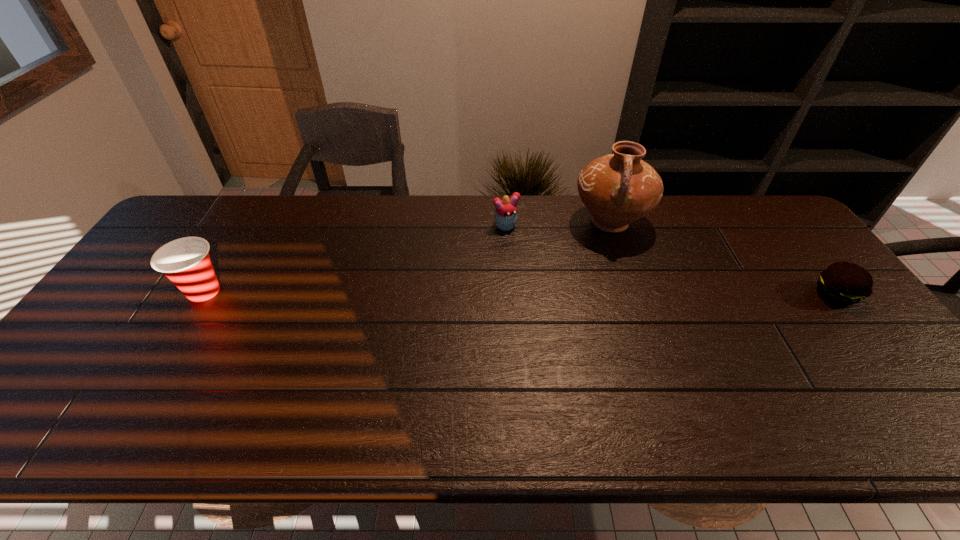
At what (x,y) coordinates should I click in order to perform the action: click on vacant space situated on the face of the second object from left to right. Please return your answer as a coordinate pair (x, y). Looking at the image, I should click on (542, 273).

The width and height of the screenshot is (960, 540). Find the location of `blank area located 0.130m on the face of the second object from left to right`. blank area located 0.130m on the face of the second object from left to right is located at coordinates [531, 258].

Locate an element on the screen. The height and width of the screenshot is (540, 960). free location located on the face of the second object from left to right is located at coordinates (555, 292).

What are the coordinates of `vacant space located 0.360m on the side of the pottery with the handle` in the screenshot? It's located at (586, 335).

What are the coordinates of `vacant area situated 0.080m on the side of the pottery with the handle` in the screenshot? It's located at (601, 264).

What are the coordinates of `vacant space located on the side of the pottery with the handle` in the screenshot? It's located at [600, 268].

Locate an element on the screen. The height and width of the screenshot is (540, 960). cupcake present at the far edge is located at coordinates 505,216.

Where is `pottery present at the far edge`? The height and width of the screenshot is (540, 960). pottery present at the far edge is located at coordinates tap(617, 189).

Identify the location of object that is at the right edge. (842, 283).

Locate an element on the screen. This screenshot has height=540, width=960. vacant region at the far edge of the desktop is located at coordinates (659, 211).